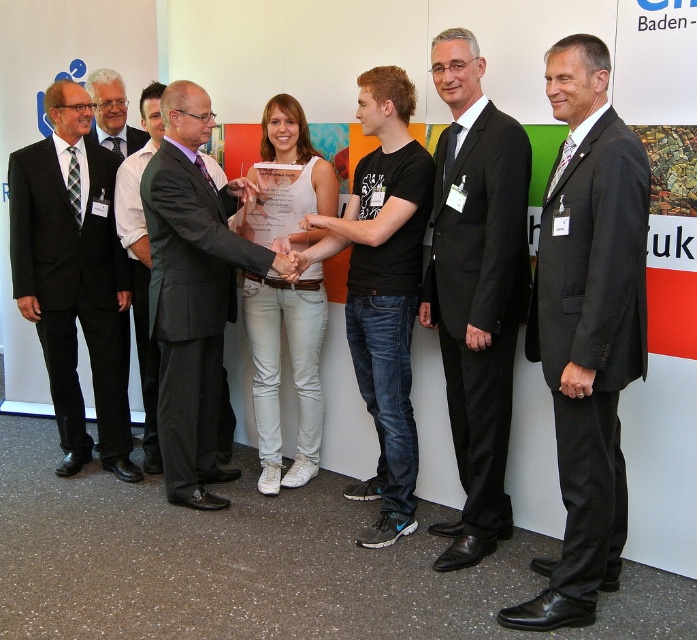
Who is lower down, black suit at center or dark gray suit at left?

black suit at center

Is point (505, 532) in front of point (99, 435)?

Yes, point (505, 532) is in front of point (99, 435).

Is point (434, 67) farther from camera compared to point (29, 269)?

That is False.

Image resolution: width=697 pixels, height=640 pixels. What are the coordinates of `black suit at center` in the screenshot? It's located at (475, 288).

Can you confirm if black suit at right is bigger than matte black suit at center?

Correct, black suit at right is larger in size than matte black suit at center.

At what (x,y) coordinates should I click in order to perform the action: click on black suit at right. Please return your answer as a coordinate pair (x, y). The width and height of the screenshot is (697, 640). Looking at the image, I should click on (588, 326).

The width and height of the screenshot is (697, 640). In order to click on black suit at right in this screenshot , I will do `click(588, 326)`.

The height and width of the screenshot is (640, 697). What are the coordinates of `black suit at right` in the screenshot? It's located at (588, 326).

In the scene shown: Is dark gray suit at center positioned at the back of matte black suit at center?

No, dark gray suit at center is in front of matte black suit at center.

Can you confirm if dark gray suit at center is positioned below matte black suit at center?

Indeed, dark gray suit at center is positioned under matte black suit at center.

Does point (254, 269) come in front of point (91, 88)?

Yes, point (254, 269) is in front of point (91, 88).

Where is `dark gray suit at center`? Image resolution: width=697 pixels, height=640 pixels. dark gray suit at center is located at coordinates (192, 291).